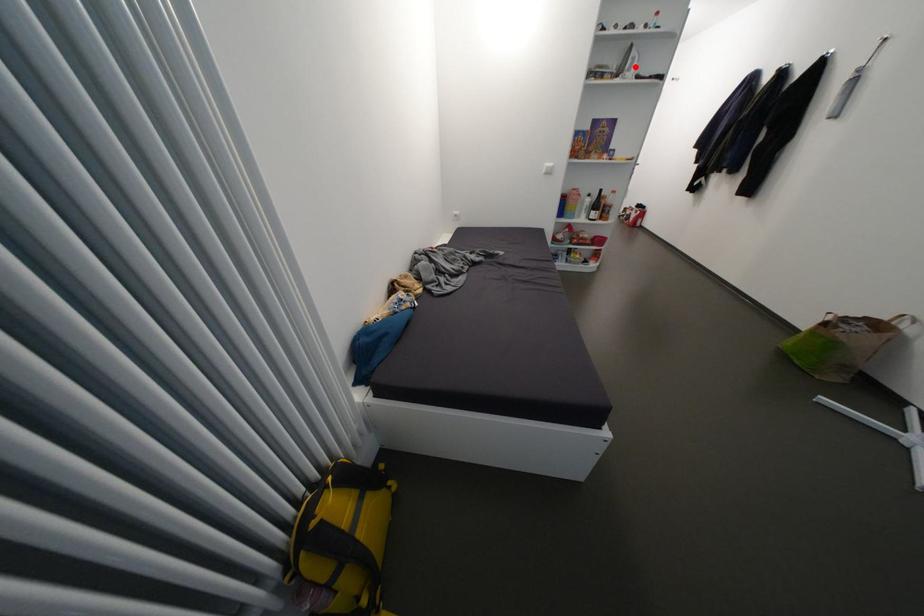
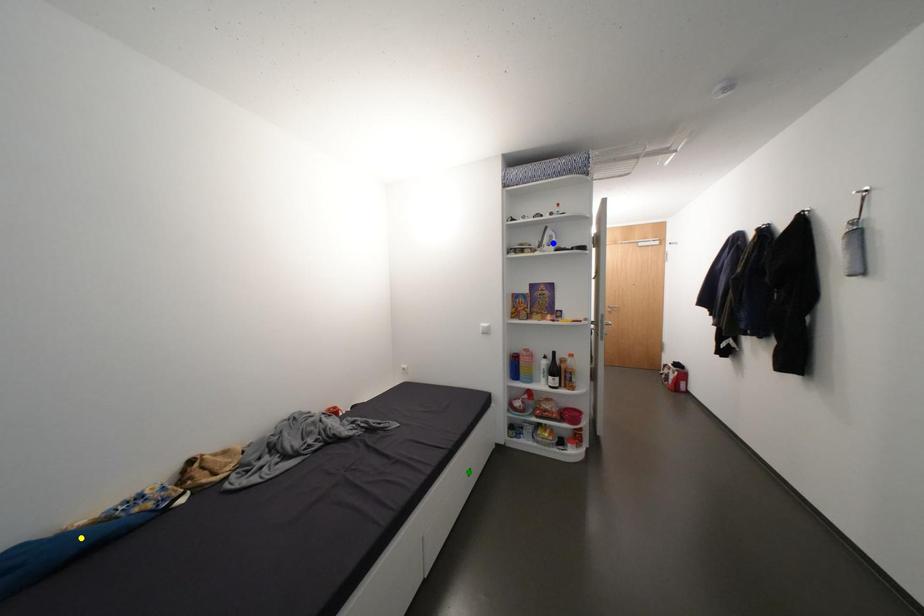
Question: I am providing you with two images of the same scene from different viewpoints. A red point is marked on the first image. You are given multiple points on the second image. Which spot in image 2 lines up with the point in image 1?

Choices:
 (A) green point
 (B) yellow point
 (C) blue point

Answer: (C)